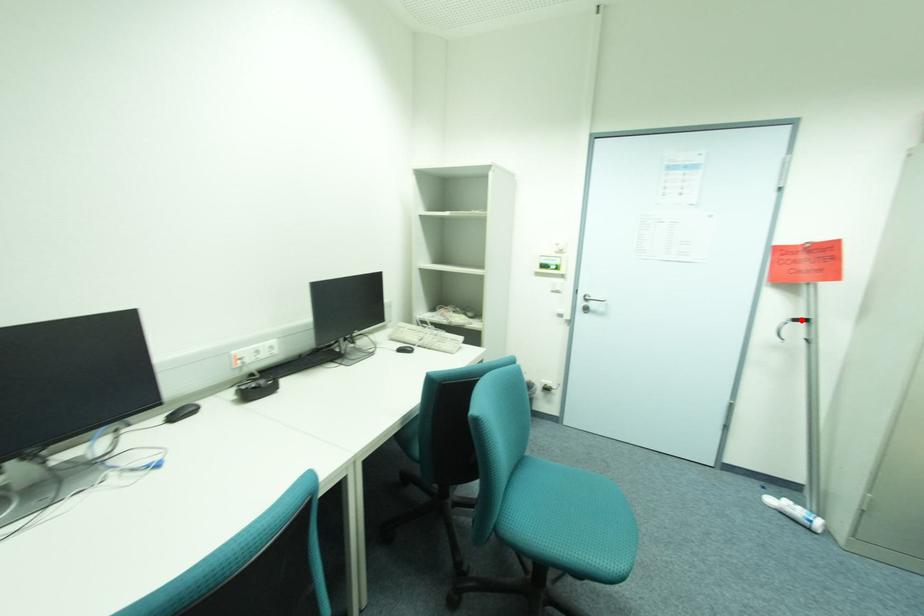
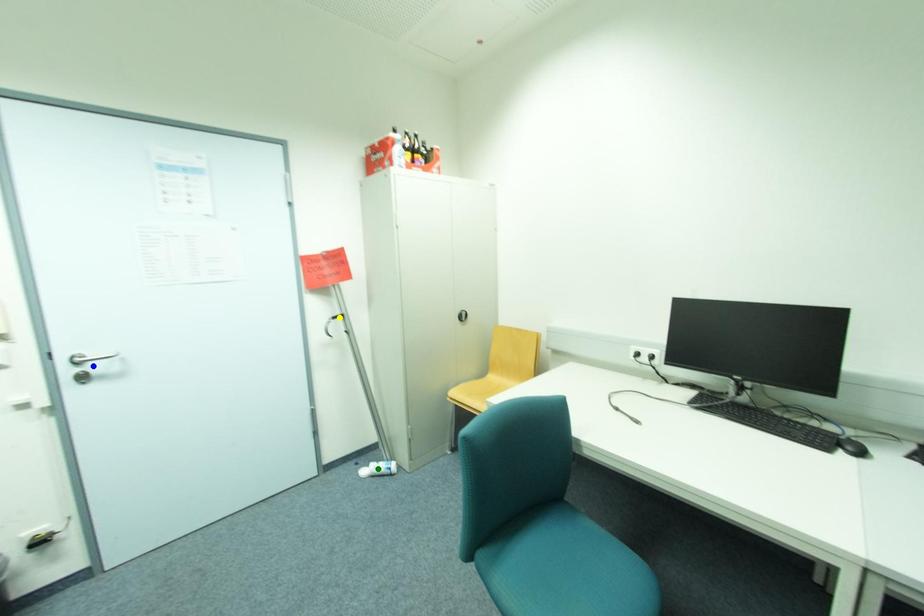
Question: I am providing you with two images of the same scene from different viewpoints. A red point is marked on the first image. You are given multiple points on the second image. Which mark in image 2 goes with the point in image 1?

Choices:
 (A) yellow point
 (B) blue point
 (C) green point

Answer: (A)